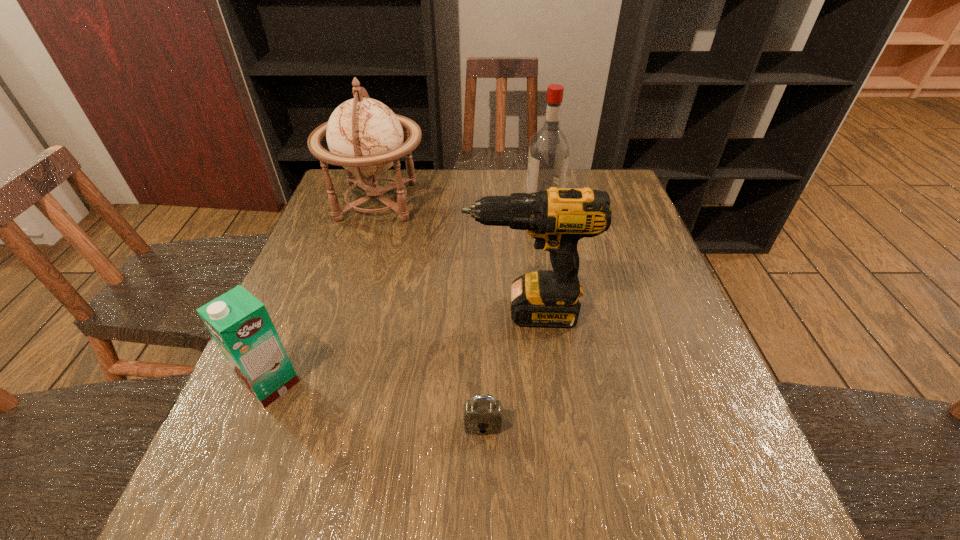
Where is `free region located on the front-facing side of the liquor`? free region located on the front-facing side of the liquor is located at coordinates (450, 201).

The image size is (960, 540). Identify the location of free space located 0.250m at the tip of the third farthest object. (354, 312).

Find the location of a particular element. This screenshot has width=960, height=540. vacant space located at the tip of the third farthest object is located at coordinates click(x=315, y=312).

Identify the location of vacant space situated 0.350m at the tip of the third farthest object. This screenshot has height=540, width=960. (310, 312).

Find the location of a particular element. Image resolution: width=960 pixels, height=540 pixels. vacant space situated 0.180m on the right of the second shortest object is located at coordinates coord(392,384).

Where is `vacant space positioned 0.060m at the front of the nearest object near the keyhole`? Image resolution: width=960 pixels, height=540 pixels. vacant space positioned 0.060m at the front of the nearest object near the keyhole is located at coordinates (483, 469).

The height and width of the screenshot is (540, 960). I want to click on globe located in the far edge section of the desktop, so click(364, 136).

Find the location of a particular element. The image size is (960, 540). liquor present at the far edge is located at coordinates (548, 157).

Where is `globe located in the left edge section of the desktop`? This screenshot has width=960, height=540. globe located in the left edge section of the desktop is located at coordinates (364, 136).

The width and height of the screenshot is (960, 540). I want to click on carton that is at the left edge, so click(239, 323).